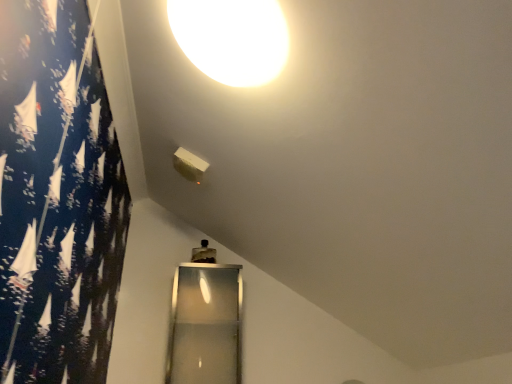
Question: From a real-world perspective, is white glossy lampshade at upper center under transparent glass door at lower center?

Choices:
 (A) yes
 (B) no

Answer: (B)

Question: Can you confirm if white glossy lampshade at upper center is positioned to the left of transparent glass door at lower center?

Choices:
 (A) yes
 (B) no

Answer: (B)

Question: Is white glossy lampshade at upper center looking in the opposite direction of transparent glass door at lower center?

Choices:
 (A) no
 (B) yes

Answer: (A)

Question: Is white glossy lampshade at upper center bigger than transparent glass door at lower center?

Choices:
 (A) no
 (B) yes

Answer: (A)

Question: Is white glossy lampshade at upper center far from transparent glass door at lower center?

Choices:
 (A) yes
 (B) no

Answer: (A)

Question: From the image's perspective, is white glossy lampshade at upper center under transparent glass door at lower center?

Choices:
 (A) yes
 (B) no

Answer: (B)

Question: Is transparent glass door at lower center bigger than white glossy lampshade at upper center?

Choices:
 (A) no
 (B) yes

Answer: (B)

Question: Can you confirm if transparent glass door at lower center is positioned to the left of white glossy lampshade at upper center?

Choices:
 (A) no
 (B) yes

Answer: (B)

Question: Is transparent glass door at lower center facing away from white glossy lampshade at upper center?

Choices:
 (A) yes
 (B) no

Answer: (B)

Question: Is transparent glass door at lower center outside of white glossy lampshade at upper center?

Choices:
 (A) no
 (B) yes

Answer: (B)

Question: From the image's perspective, does transparent glass door at lower center appear lower than white glossy lampshade at upper center?

Choices:
 (A) yes
 (B) no

Answer: (A)

Question: Is transparent glass door at lower center positioned far away from white glossy lampshade at upper center?

Choices:
 (A) no
 (B) yes

Answer: (B)

Question: In the image, is white glossy lampshade at upper center on the left side or the right side of transparent glass door at lower center?

Choices:
 (A) right
 (B) left

Answer: (A)